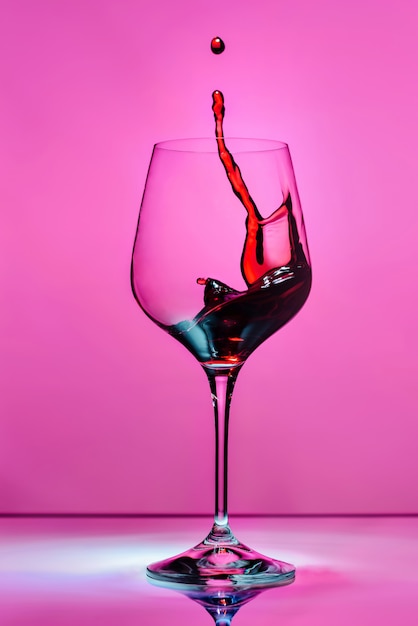
Identify the location of glass stem. The image size is (418, 626). (222, 458).